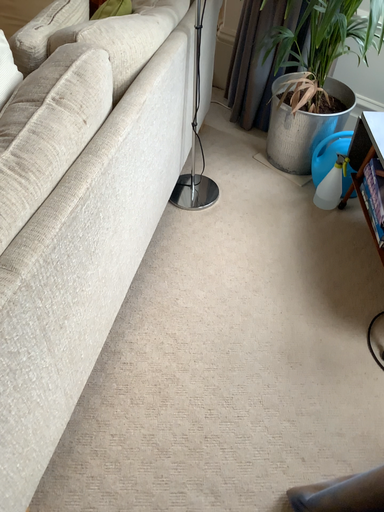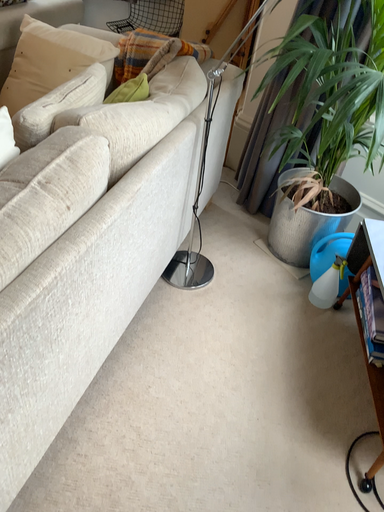
Question: How did the camera likely rotate when shooting the video?

Choices:
 (A) rotated downward
 (B) rotated upward

Answer: (B)